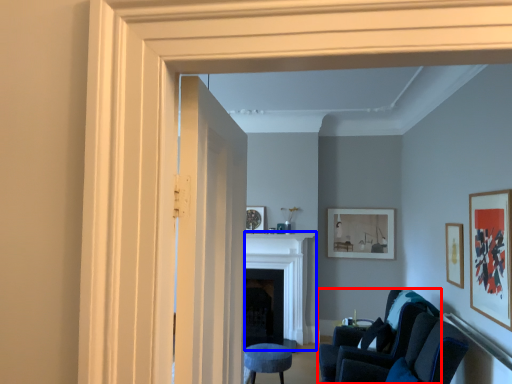
Question: Which object appears closest to the camera in this image, chair (highlighted by a red box) or fireplace (highlighted by a blue box)?

Choices:
 (A) chair
 (B) fireplace

Answer: (A)